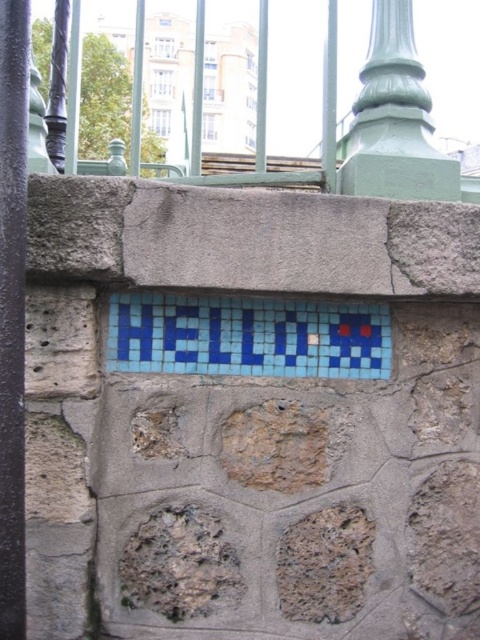
You are a painter assessing the area to paint. You need to know which object is shorter between the green painted metal fence at upper center and the green painted metal pillar at upper center. Which one requires less ladder height?

The green painted metal fence at upper center has a lesser height compared to the green painted metal pillar at upper center, so the green painted metal fence at upper center requires less ladder height.

You are a painter who needs to paint both the smooth purple pole at left and the green painted metal pillar at upper center. Which object should you paint first if you want to start with the taller one?

The smooth purple pole at left is taller than the green painted metal pillar at upper center, so you should paint the smooth purple pole at left first.

You are standing in front of the stone wall with the mosaic sign. You notice two green painted metal structures at the upper center of the wall. Which one is positioned higher between the green painted metal fence at upper center and the green painted metal pillar at upper center?

The green painted metal fence at upper center is positioned higher than the green painted metal pillar at upper center because it is above it.